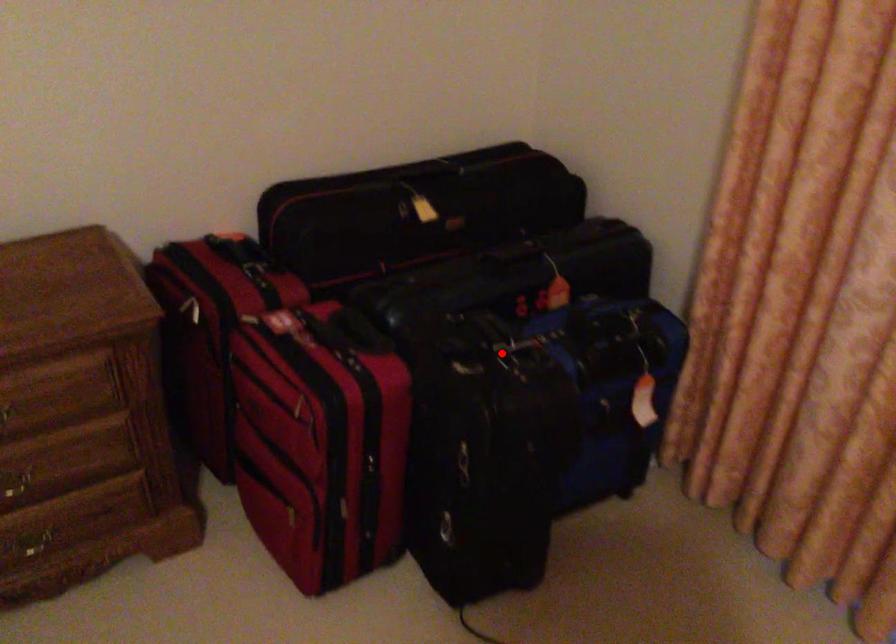
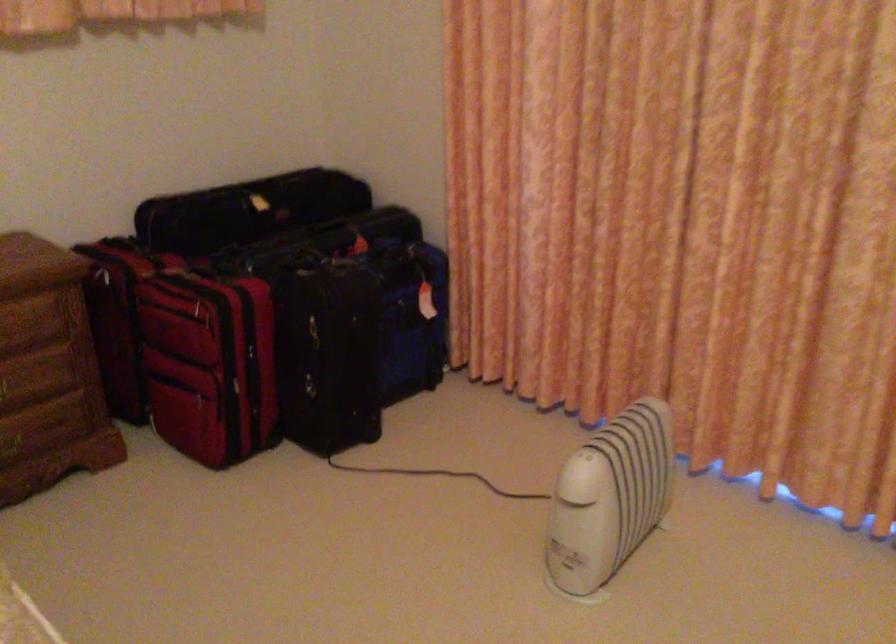
Locate, in the second image, the point that corresponds to the highlighted location in the first image.

(330, 266)